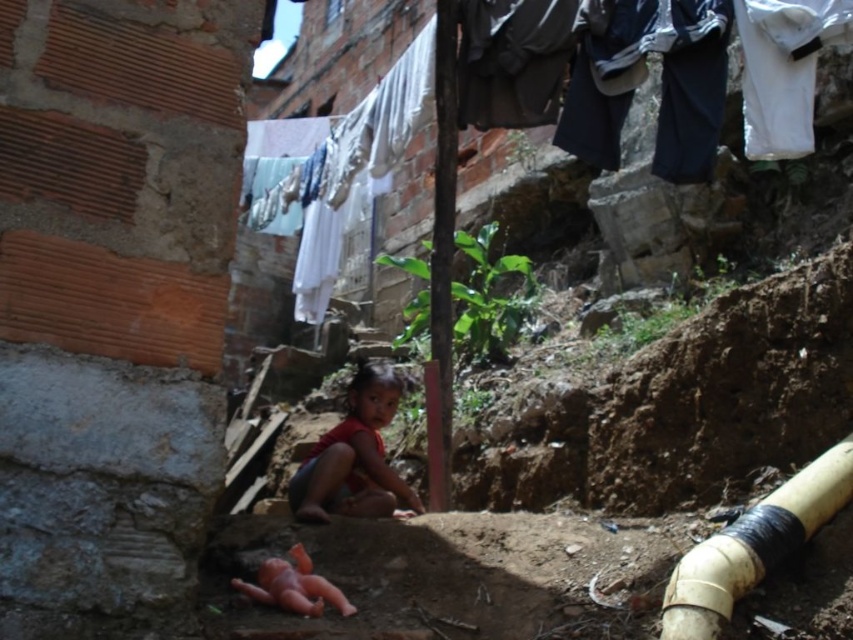
You are a delivery person who needs to place a small package between the yellow matte water pipe at lower right and the red matte dress at center. Based on the scene description, where should you place the package so it is not under either object?

The yellow matte water pipe at lower right is above the red matte dress at center. To place the package so it is not under either object, position it below the red matte dress at center but above the water pipe. However, since the water pipe is already above the dress, there might not be space between them. Alternatively, place it to the side of both objects where there is clear ground.

You are a delivery person who needs to place a package on the ground near the yellow matte water pipe at lower right. Based on the image, where exactly should you place the package?

The yellow matte water pipe at lower right is located at point (753,545), so you should place the package near that coordinate.

You are a delivery person who needs to place a small box between the yellow matte water pipe at lower right and the red matte dress at center. Based on their heights, which object should you place the box closer to so it won

The yellow matte water pipe at lower right is shorter than the red matte dress at center. To ensure the box is placed closer to the shorter object, you should place it near the yellow matte water pipe at lower right.